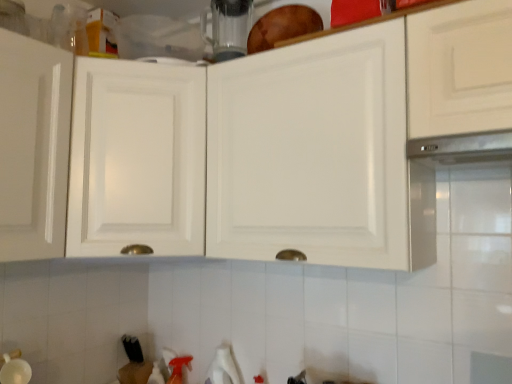
Question: Is white glossy cabinet at upper center, the second cabinetry viewed from the right, not within white glossy cabinet at upper center, marked as the second cabinetry in a left-to-right arrangement?

Choices:
 (A) no
 (B) yes

Answer: (B)

Question: Is white glossy cabinet at upper center, placed as the first cabinetry when sorted from right to left, at the back of white glossy cabinet at upper center, the second cabinetry viewed from the right?

Choices:
 (A) yes
 (B) no

Answer: (B)

Question: Is white glossy cabinet at upper center, placed as the first cabinetry when sorted from right to left, surrounded by white glossy cabinet at upper center, the second cabinetry viewed from the right?

Choices:
 (A) no
 (B) yes

Answer: (A)

Question: From the image's perspective, is white glossy cabinet at upper center, the first cabinetry from the left, on top of white glossy cabinet at upper center, marked as the second cabinetry in a left-to-right arrangement?

Choices:
 (A) yes
 (B) no

Answer: (B)

Question: Is white glossy cabinet at upper center, the second cabinetry viewed from the right, further to the viewer compared to white glossy cabinet at upper center, placed as the first cabinetry when sorted from right to left?

Choices:
 (A) no
 (B) yes

Answer: (B)

Question: Would you consider white glossy cabinet at upper center, the second cabinetry viewed from the right, to be distant from white glossy cabinet at upper center, placed as the first cabinetry when sorted from right to left?

Choices:
 (A) yes
 (B) no

Answer: (B)

Question: Can you confirm if satin metallic exhaust hood at upper right is positioned to the left of white glossy cabinet at upper center, placed as the first cabinetry when sorted from right to left?

Choices:
 (A) yes
 (B) no

Answer: (B)

Question: Would you say satin metallic exhaust hood at upper right is outside white glossy cabinet at upper center, marked as the second cabinetry in a left-to-right arrangement?

Choices:
 (A) no
 (B) yes

Answer: (A)

Question: Does satin metallic exhaust hood at upper right have a greater height compared to white glossy cabinet at upper center, marked as the second cabinetry in a left-to-right arrangement?

Choices:
 (A) no
 (B) yes

Answer: (A)

Question: From the image's perspective, is satin metallic exhaust hood at upper right on top of white glossy cabinet at upper center, placed as the first cabinetry when sorted from right to left?

Choices:
 (A) yes
 (B) no

Answer: (A)

Question: From a real-world perspective, is satin metallic exhaust hood at upper right beneath white glossy cabinet at upper center, marked as the second cabinetry in a left-to-right arrangement?

Choices:
 (A) yes
 (B) no

Answer: (A)

Question: From a real-world perspective, is satin metallic exhaust hood at upper right positioned over white glossy cabinet at upper center, marked as the second cabinetry in a left-to-right arrangement, based on gravity?

Choices:
 (A) no
 (B) yes

Answer: (A)

Question: Are white glossy cabinet at upper center, placed as the first cabinetry when sorted from right to left, and satin metallic exhaust hood at upper right located far from each other?

Choices:
 (A) no
 (B) yes

Answer: (A)